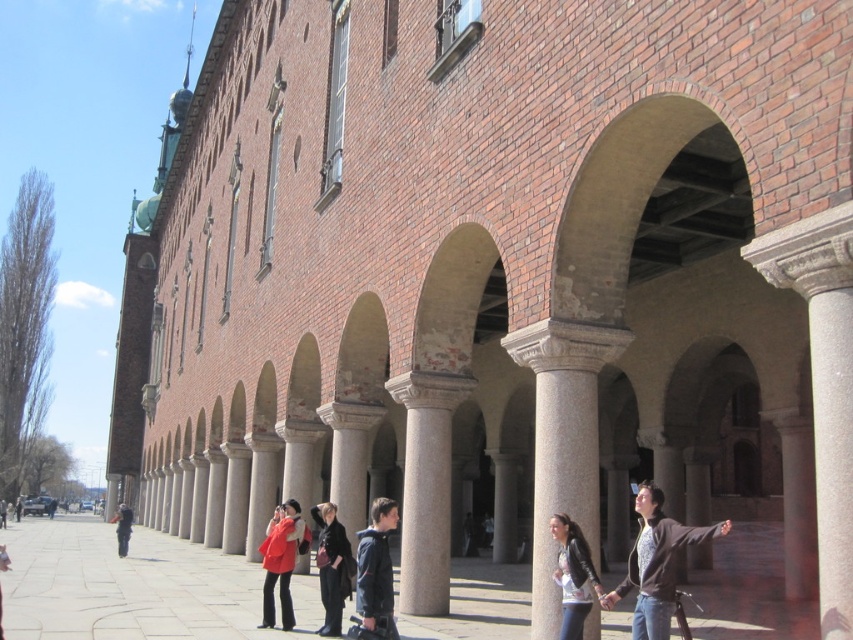
Question: Among these points, which one is nearest to the camera?

Choices:
 (A) (671, 582)
 (B) (561, 554)
 (C) (323, 600)
 (D) (544, 604)

Answer: (A)

Question: Does dark brown leather jacket at lower right appear over dark blue jacket at center?

Choices:
 (A) yes
 (B) no

Answer: (B)

Question: Which object appears closest to the camera in this image?

Choices:
 (A) smooth concrete pavement at center
 (B) dark gray jacket at lower left

Answer: (A)

Question: Is dark brown leather jacket at lower right to the right of dark gray jacket at lower left from the viewer's perspective?

Choices:
 (A) no
 (B) yes

Answer: (B)

Question: Which of the following is the closest to the observer?

Choices:
 (A) smooth concrete pavement at center
 (B) dark brown leather jacket at lower right
 (C) matte black jacket at lower right

Answer: (B)

Question: Is smooth stone column at center bigger than dark blue jacket at center?

Choices:
 (A) no
 (B) yes

Answer: (B)